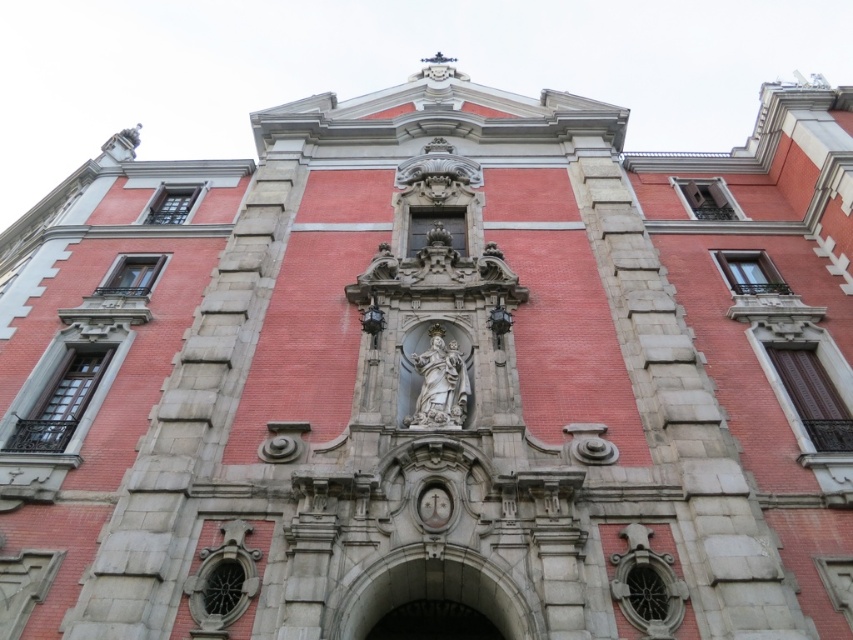
From the picture: You are an architect examining the building facade. You notice the white stone arch at center and the white marble statue at center. Which of these two elements is taller?

The white marble statue at center is taller than the white stone arch at center.

You are standing in front of the historic building and want to take a photo of both the white stone arch at center and the white marble statue at center. Which one will appear larger in your photo?

The white stone arch at center will appear larger in the photo because it is closer to the viewer than the white marble statue at center.